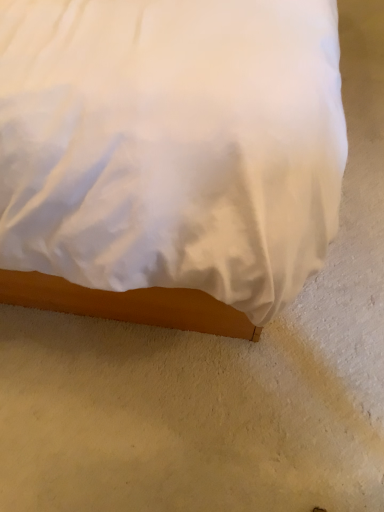
Find the location of a particular element. The height and width of the screenshot is (512, 384). white satin bed at center is located at coordinates (168, 156).

The height and width of the screenshot is (512, 384). Describe the element at coordinates (168, 156) in the screenshot. I see `white satin bed at center` at that location.

Where is `white satin bed at center`? This screenshot has height=512, width=384. white satin bed at center is located at coordinates (168, 156).